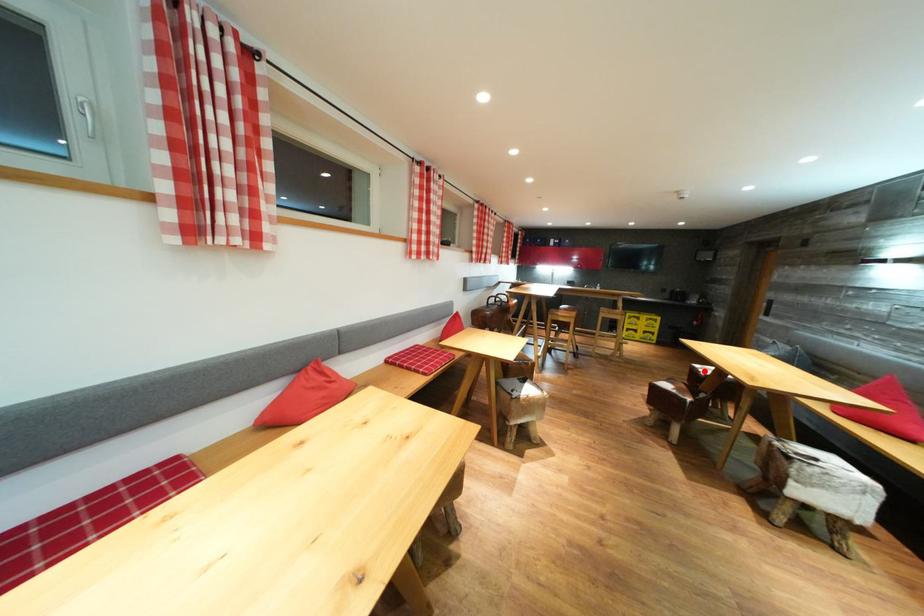
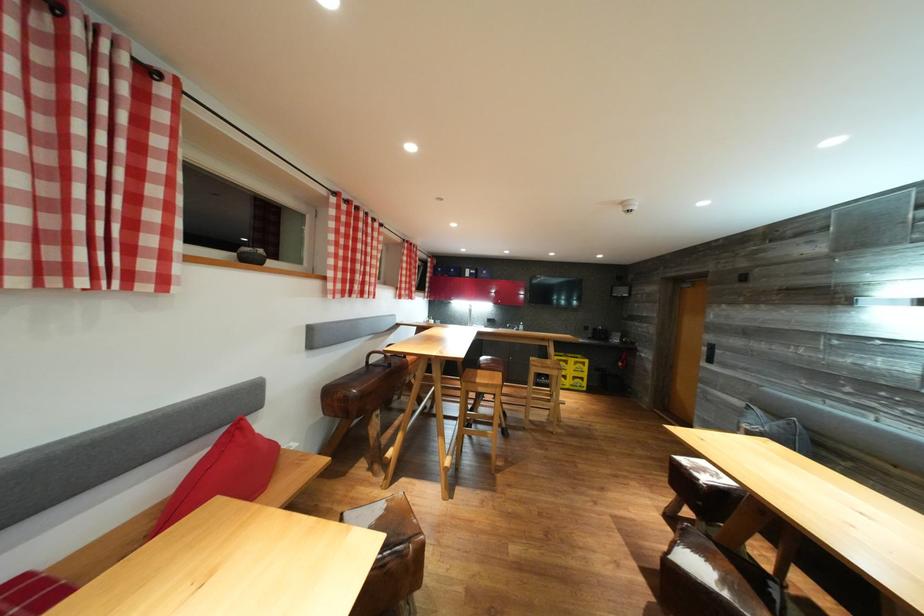
Question: I am providing you with two images of the same scene from different viewpoints. Image1 has a red point marked. In image2, the corresponding 3D location appears at what relative position? Reply with the corresponding letter.

Choices:
 (A) Closer
 (B) Farther

Answer: (B)